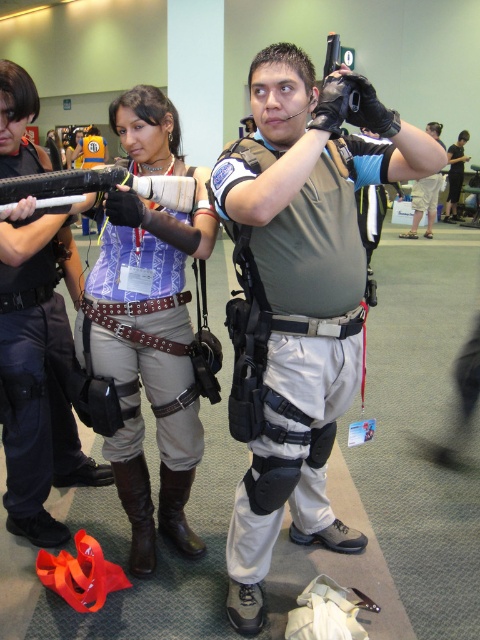
Does matte black tactical vest at center lie behind matte black gun at upper left?

That is False.

The height and width of the screenshot is (640, 480). Find the location of `matte black tactical vest at center`. matte black tactical vest at center is located at coordinates (299, 298).

Measure the distance between point (327,305) and camera.

The distance of point (327,305) from camera is 4.81 feet.

At what (x,y) coordinates should I click in order to perform the action: click on matte black tactical vest at center. Please return your answer as a coordinate pair (x, y). Looking at the image, I should click on pyautogui.click(x=299, y=298).

Which is in front, point (17, 300) or point (430, 234)?

Point (17, 300) is in front.

What do you see at coordinates (36, 378) in the screenshot?
I see `matte black gun at upper left` at bounding box center [36, 378].

Who is more distant from viewer, (37, 259) or (428, 218)?

Positioned behind is point (428, 218).

This screenshot has height=640, width=480. In order to click on matte black gun at upper left in this screenshot , I will do pyautogui.click(x=36, y=378).

Does point (98, 285) come in front of point (454, 189)?

Yes, point (98, 285) is closer to viewer.

Does matte purple shirt at center have a greater height compared to black leather gloves at upper center?

Yes.

Does point (164, 435) come behind point (448, 177)?

No, it is not.

Where is `matte purple shirt at center`? The height and width of the screenshot is (640, 480). matte purple shirt at center is located at coordinates (149, 323).